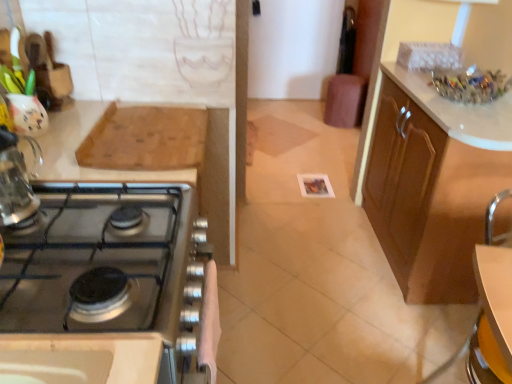
Find the location of a particular element. The height and width of the screenshot is (384, 512). free location above brown wood cabinet at right, positioned as the 2th cabinetry in front-to-back order (from a real-world perspective) is located at coordinates [452, 101].